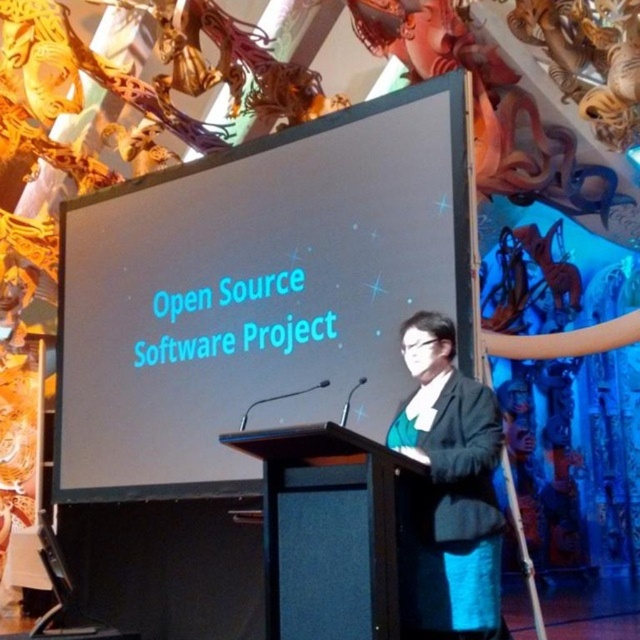
Question: Which point is closer to the camera?

Choices:
 (A) dark gray suit at center
 (B) black glossy projection screen at center

Answer: (A)

Question: Which point is closer to the camera?

Choices:
 (A) (442, 444)
 (B) (83, 372)

Answer: (A)

Question: Where is black glossy projection screen at center located in relation to black matte podium at center in the image?

Choices:
 (A) above
 (B) below

Answer: (A)

Question: Can you confirm if black glossy projection screen at center is positioned to the left of dark gray suit at center?

Choices:
 (A) no
 (B) yes

Answer: (B)

Question: Can you confirm if black glossy projection screen at center is smaller than black matte podium at center?

Choices:
 (A) yes
 (B) no

Answer: (A)

Question: Considering the real-world distances, which object is closest to the black matte podium at center?

Choices:
 (A) dark gray suit at center
 (B) black glossy projection screen at center

Answer: (A)